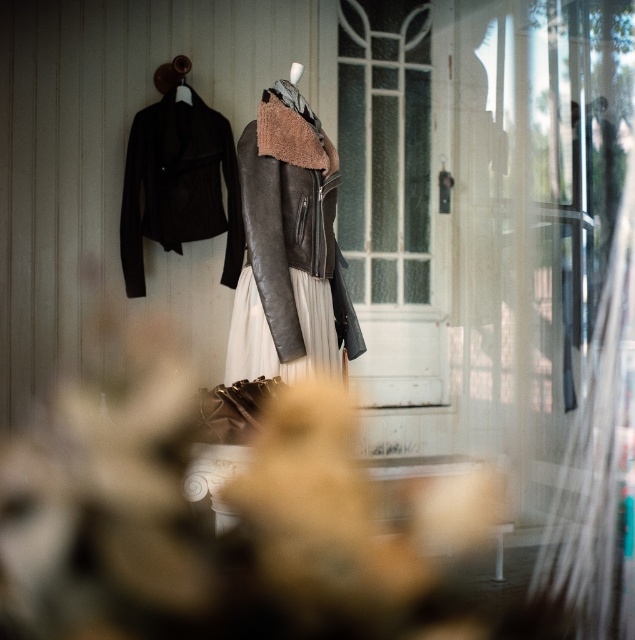
Looking at this image, you are a customer in the store and want to buy both the matte black leather jacket at center and the leather dress at center. If you stand facing the mannequin, which item is positioned to the right side?

The matte black leather jacket at center is to the right of the leather dress at center, so when facing the mannequin, the matte black leather jacket at center would be on your right side.

You are a customer in the store and want to know which jacket is larger between the leather jacket at center and the matte black leather jacket at left. Can you tell me?

The leather jacket at center is bigger than the matte black leather jacket at left.

You are a customer in the store and want to touch the matte black leather jacket at center. From your current position, which direction should you move to reach it?

The matte black leather jacket at center is located at point (384,148), so you should move towards the center of the image to reach it.